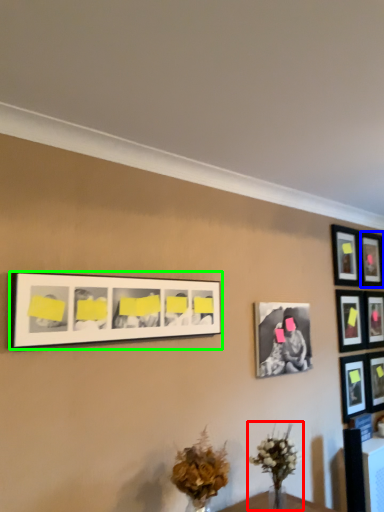
Question: Which is farther away from floral arrangement (highlighted by a red box)? picture frame (highlighted by a blue box) or picture frame (highlighted by a green box)?

Choices:
 (A) picture frame
 (B) picture frame

Answer: (A)